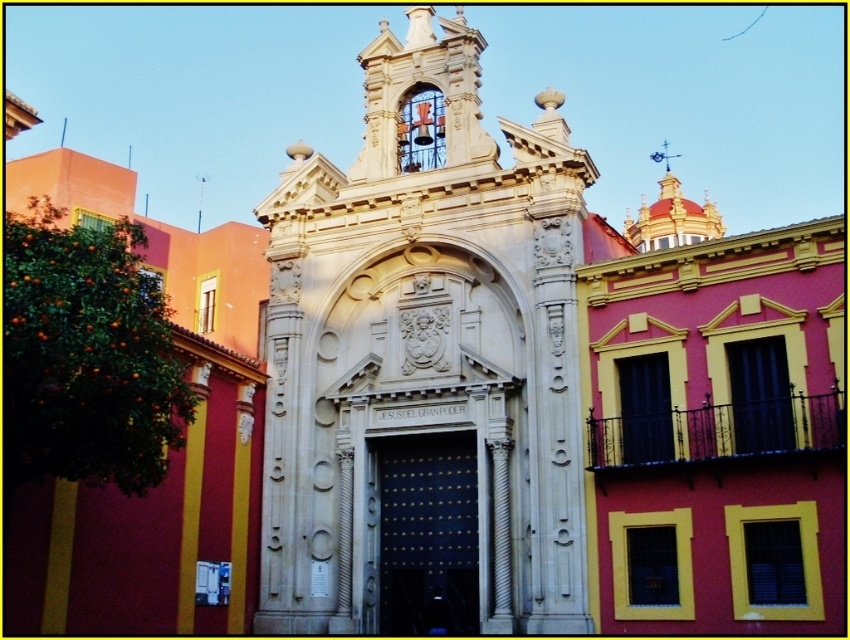
In the scene shown: You are a photographer planning to capture the white stone chapel at center and the green leafy tree at left in a single frame. Based on their sizes, which one should appear larger in your photo?

The white stone chapel at center is taller than the green leafy tree at left, so it should appear larger in the photo.

You are a photographer planning to take a wide shot of the white stone chapel at center and the green leafy tree at left. Based on their sizes, which one should you focus on to ensure it dominates the frame?

The white stone chapel at center is bigger than the green leafy tree at left, so focusing on it will ensure it dominates the frame.

You are standing at the entrance of the grand building and notice a specific point marked at coordinates (425,353). What architectural feature is located at this point?

The point at coordinates (425,353) marks the location of the white stone chapel at center.